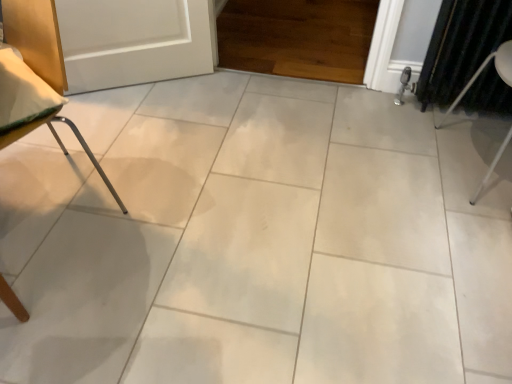
Question: Does white metal chair at right, the second furniture viewed from the left, have a smaller size compared to dark green fabric curtain at right?

Choices:
 (A) yes
 (B) no

Answer: (B)

Question: Is white metal chair at right, the second furniture viewed from the left, positioned behind dark green fabric curtain at right?

Choices:
 (A) no
 (B) yes

Answer: (A)

Question: Can you confirm if white metal chair at right, the first furniture positioned from the right, is shorter than dark green fabric curtain at right?

Choices:
 (A) no
 (B) yes

Answer: (A)

Question: Considering the relative sizes of white metal chair at right, the first furniture positioned from the right, and dark green fabric curtain at right in the image provided, is white metal chair at right, the first furniture positioned from the right, wider than dark green fabric curtain at right?

Choices:
 (A) yes
 (B) no

Answer: (A)

Question: Is white metal chair at right, the second furniture viewed from the left, oriented away from dark green fabric curtain at right?

Choices:
 (A) no
 (B) yes

Answer: (A)

Question: From the image's perspective, is white metal chair at right, the first furniture positioned from the right, above or below dark green fabric curtain at right?

Choices:
 (A) above
 (B) below

Answer: (B)

Question: Which is correct: white metal chair at right, the second furniture viewed from the left, is inside dark green fabric curtain at right, or outside of it?

Choices:
 (A) inside
 (B) outside

Answer: (B)

Question: In terms of width, does white metal chair at right, the second furniture viewed from the left, look wider or thinner when compared to dark green fabric curtain at right?

Choices:
 (A) wide
 (B) thin

Answer: (A)

Question: Is white metal chair at right, the second furniture viewed from the left, bigger or smaller than dark green fabric curtain at right?

Choices:
 (A) small
 (B) big

Answer: (B)

Question: Considering their positions, is white metal chair at right, the second furniture viewed from the left, located in front of or behind metallic silver chair leg at left, positioned as the second furniture in right-to-left order?

Choices:
 (A) behind
 (B) front

Answer: (A)

Question: Is white metal chair at right, the second furniture viewed from the left, inside or outside of metallic silver chair leg at left, marked as the 1th furniture in a left-to-right arrangement?

Choices:
 (A) inside
 (B) outside

Answer: (B)

Question: From a real-world perspective, is white metal chair at right, the second furniture viewed from the left, above or below metallic silver chair leg at left, marked as the 1th furniture in a left-to-right arrangement?

Choices:
 (A) above
 (B) below

Answer: (B)

Question: In the image, is white metal chair at right, the second furniture viewed from the left, on the left side or the right side of metallic silver chair leg at left, positioned as the second furniture in right-to-left order?

Choices:
 (A) left
 (B) right

Answer: (B)

Question: In terms of width, does metallic silver chair leg at left, marked as the 1th furniture in a left-to-right arrangement, look wider or thinner when compared to dark green fabric curtain at right?

Choices:
 (A) wide
 (B) thin

Answer: (A)

Question: Is metallic silver chair leg at left, positioned as the second furniture in right-to-left order, bigger or smaller than dark green fabric curtain at right?

Choices:
 (A) small
 (B) big

Answer: (B)